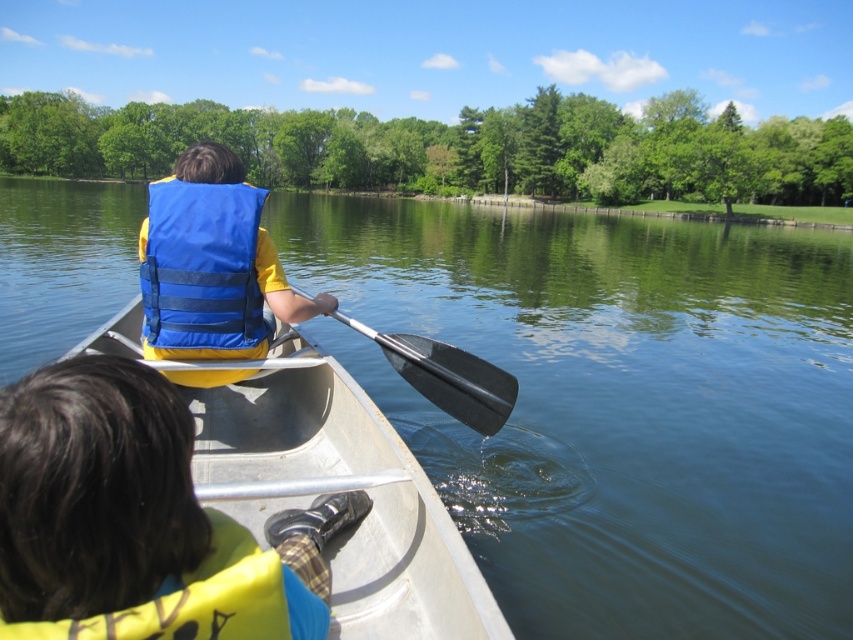
Who is higher up, yellow fabric life vest at center or blue fabric life jacket at center?

blue fabric life jacket at center

Is yellow fabric life vest at center above blue fabric life jacket at center?

No.

Which is behind, point (184, 481) or point (181, 307)?

Positioned behind is point (181, 307).

I want to click on yellow fabric life vest at center, so click(x=138, y=520).

Which is behind, point (840, 600) or point (187, 592)?

The point (840, 600) is more distant.

Can you confirm if clear blue water at center is thinner than yellow fleece life jacket at lower left?

No, clear blue water at center is not thinner than yellow fleece life jacket at lower left.

Find the location of `clear blue water at center`. clear blue water at center is located at coordinates [616, 404].

Can you confirm if yellow fabric life vest at center is taller than yellow fleece life jacket at lower left?

Indeed, yellow fabric life vest at center has a greater height compared to yellow fleece life jacket at lower left.

Which is behind, point (167, 502) or point (105, 627)?

Point (167, 502)

Describe the element at coordinates (138, 520) in the screenshot. I see `yellow fabric life vest at center` at that location.

Identify the location of yellow fabric life vest at center. (138, 520).